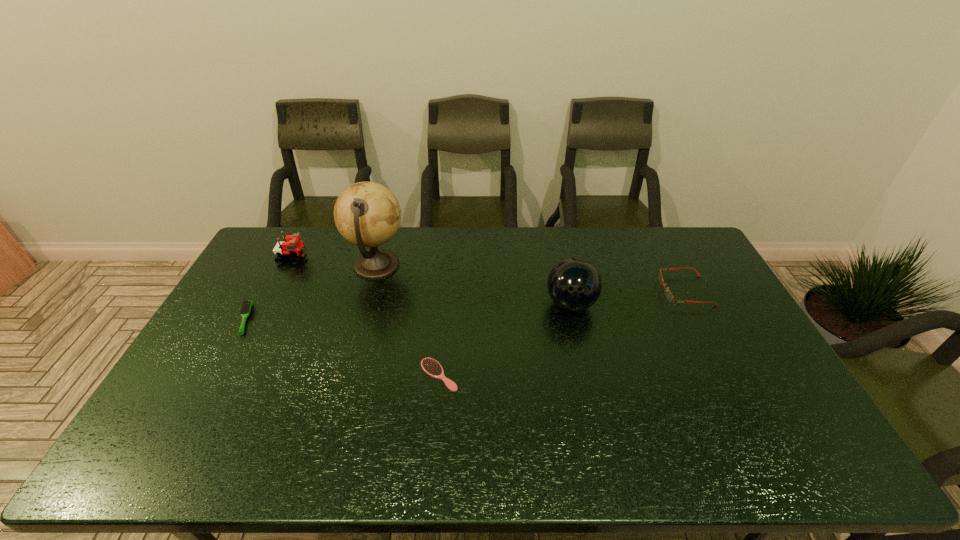
Identify the location of the nearer hairbrush. (430, 366).

The height and width of the screenshot is (540, 960). I want to click on free space located 0.070m on the front-facing side of the third object from left to right, so click(426, 266).

In order to click on free region located on the side of the bowling ball with the finger holes in this screenshot , I will do `click(601, 440)`.

Locate an element on the screen. vacant space located 0.160m on the front-facing side of the Lego is located at coordinates (350, 258).

At what (x,y) coordinates should I click in order to perform the action: click on vacant space situated 0.180m on the lenses of the rightmost object. Please return your answer as a coordinate pair (x, y). The width and height of the screenshot is (960, 540). Looking at the image, I should click on (608, 291).

The image size is (960, 540). What are the coordinates of `free space located 0.090m on the lenses of the rightmost object` in the screenshot? It's located at (635, 291).

Where is `vacant space located 0.210m on the lenses of the rightmost object`? Image resolution: width=960 pixels, height=540 pixels. vacant space located 0.210m on the lenses of the rightmost object is located at coordinates (599, 291).

Locate an element on the screen. vacant space situated 0.400m on the front of the taller hairbrush is located at coordinates (165, 464).

I want to click on vacant position located on the back of the fourth object from left to right, so click(x=446, y=292).

This screenshot has height=540, width=960. Find the location of `globe at the far edge`. globe at the far edge is located at coordinates (367, 214).